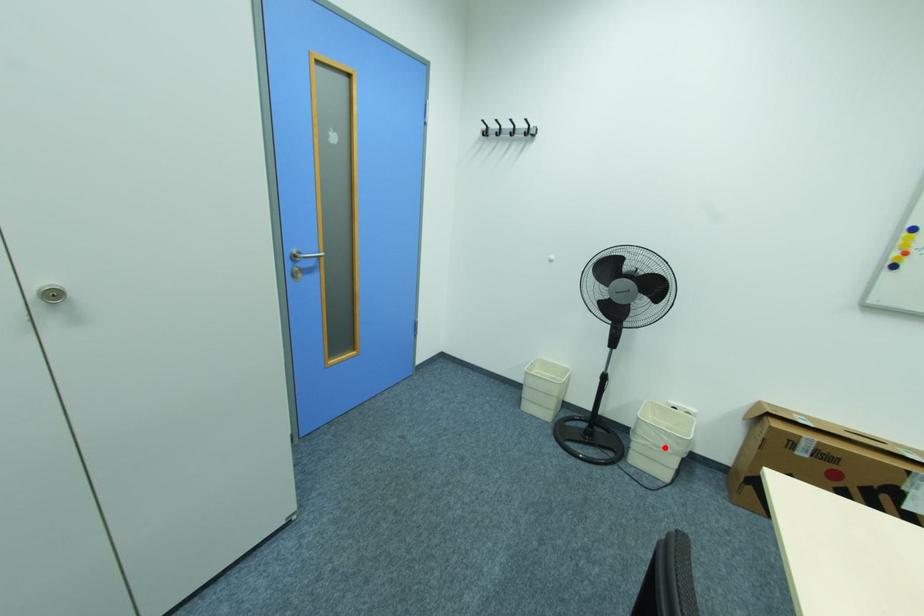
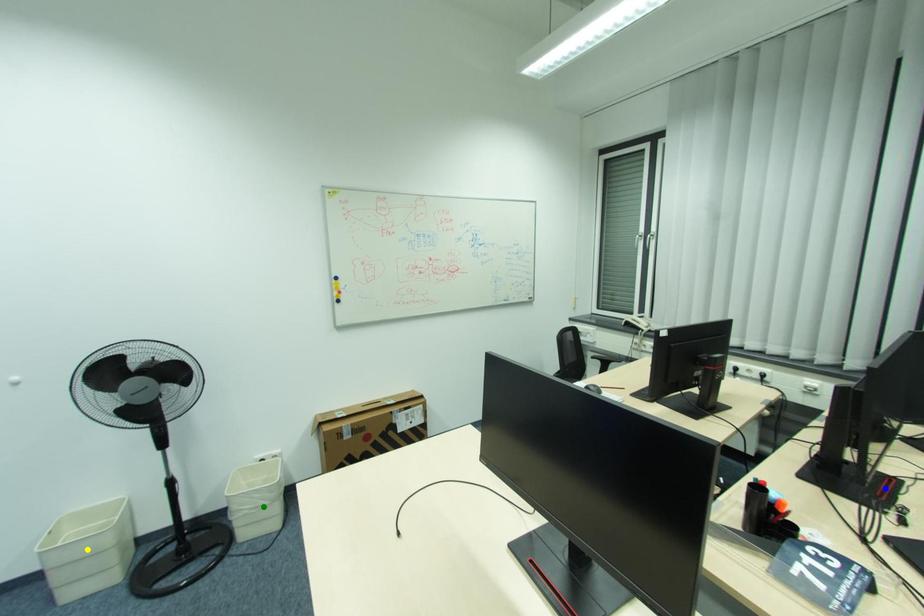
Question: I am providing you with two images of the same scene from different viewpoints. A red point is marked on the first image. You are given multiple points on the second image. In image 2, which mark is for the same physical point as the one in image 1?

Choices:
 (A) blue point
 (B) yellow point
 (C) green point

Answer: (C)